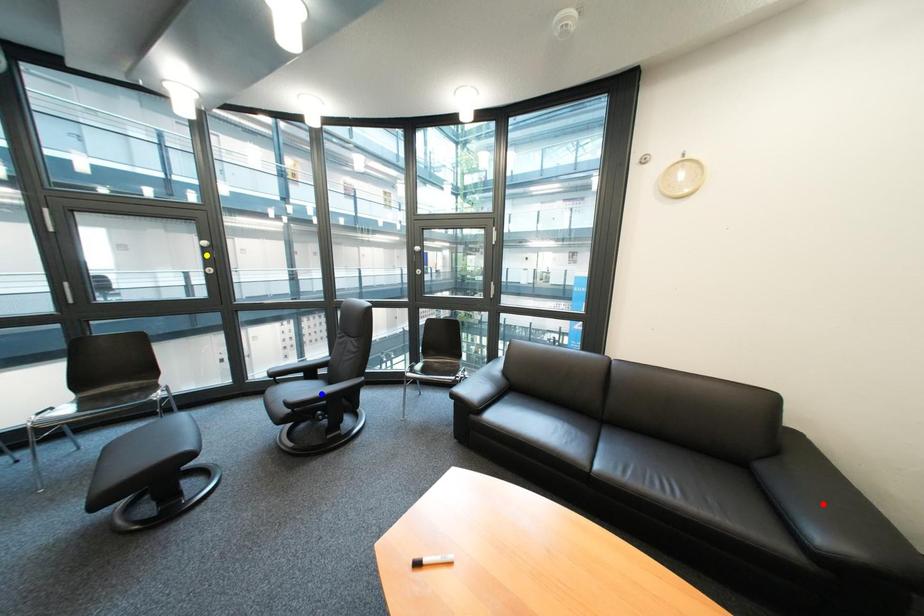
Order these from nearest to farthest:
A) blue point
B) red point
C) yellow point

1. yellow point
2. blue point
3. red point